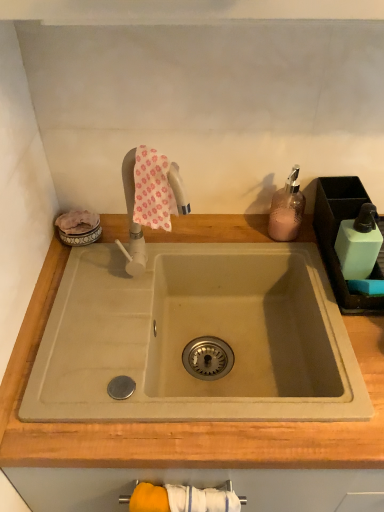
Locate an element on the screen. Image resolution: width=384 pixels, height=512 pixels. free spot in front of pink textured soap dispenser at upper right is located at coordinates (306, 265).